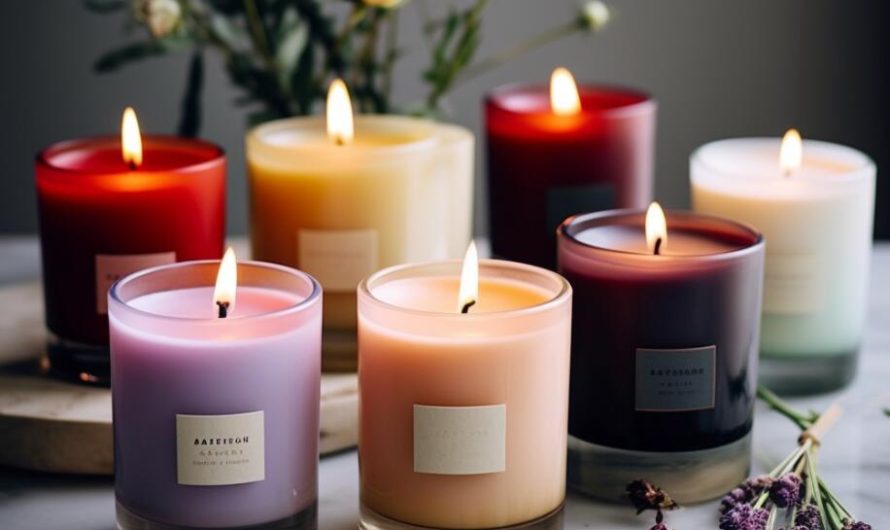
Where is `candle labels`? This screenshot has width=890, height=530. candle labels is located at coordinates (219, 453), (118, 269), (337, 259), (463, 441), (678, 384), (786, 278), (575, 200).